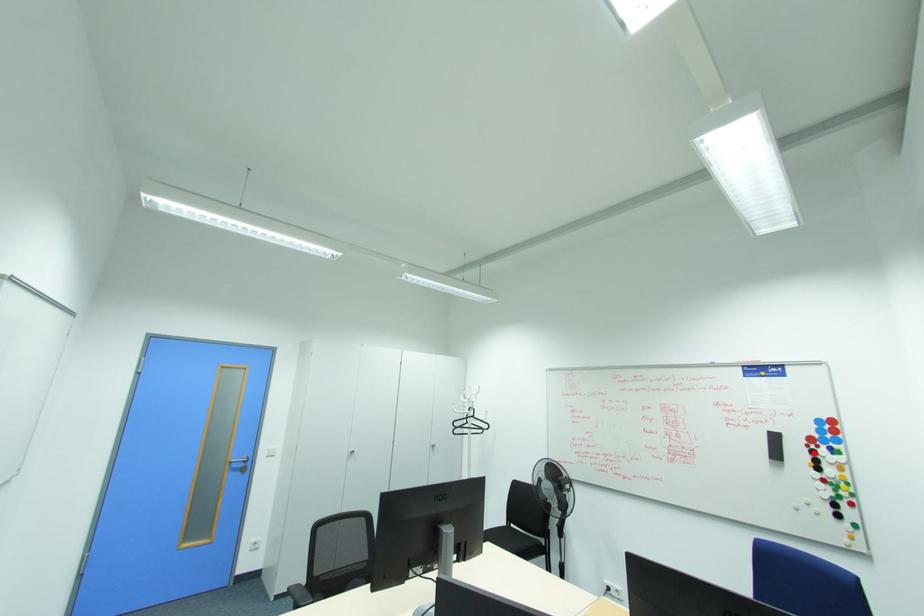
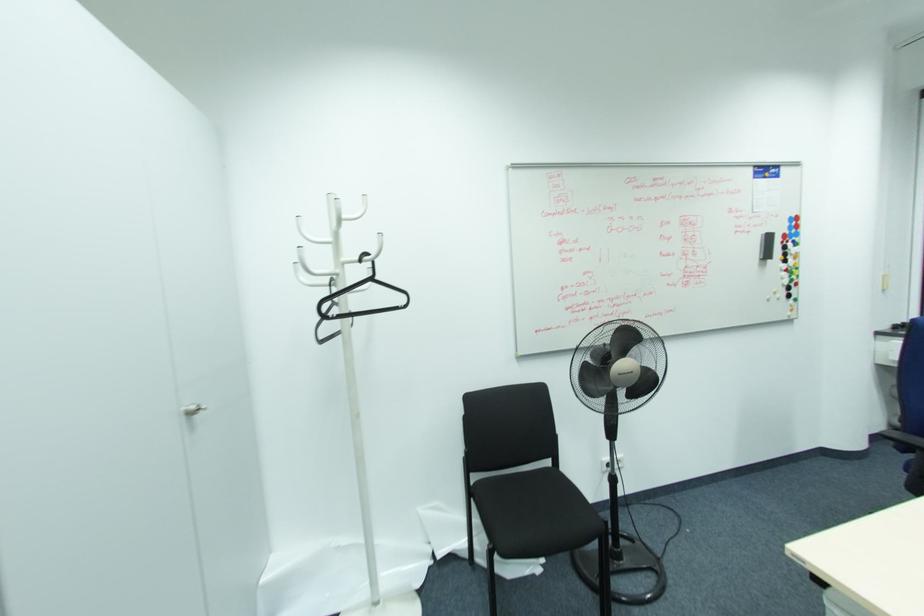
Where in the second image is the point corresponding to the highlighted location from the first image?

(785, 248)